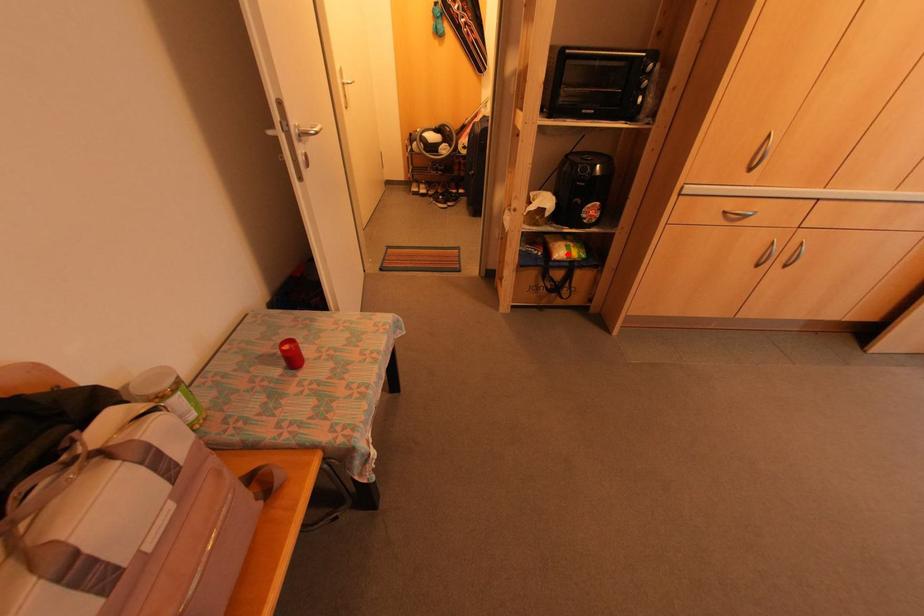
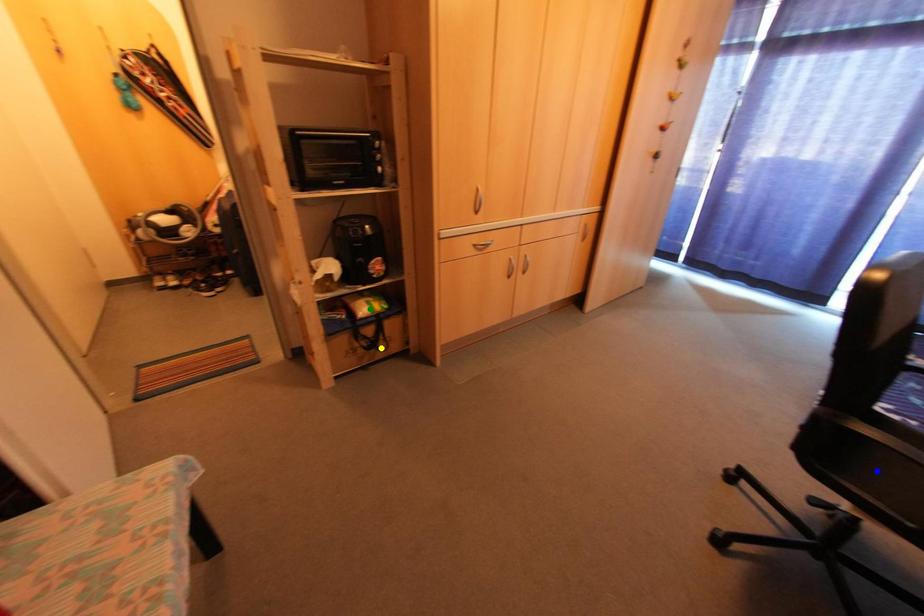
Question: I am providing you with two images of the same scene from different viewpoints. A red point is marked on the first image. You are given multiple points on the second image. Which spot in image 2 lines up with the point in image 1?

Choices:
 (A) yellow point
 (B) blue point
 (C) green point

Answer: (C)